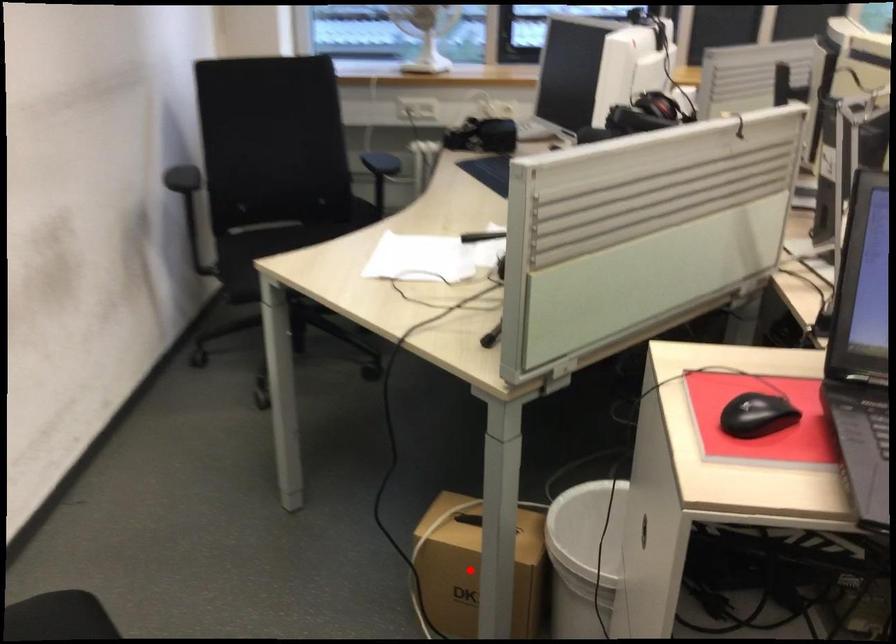
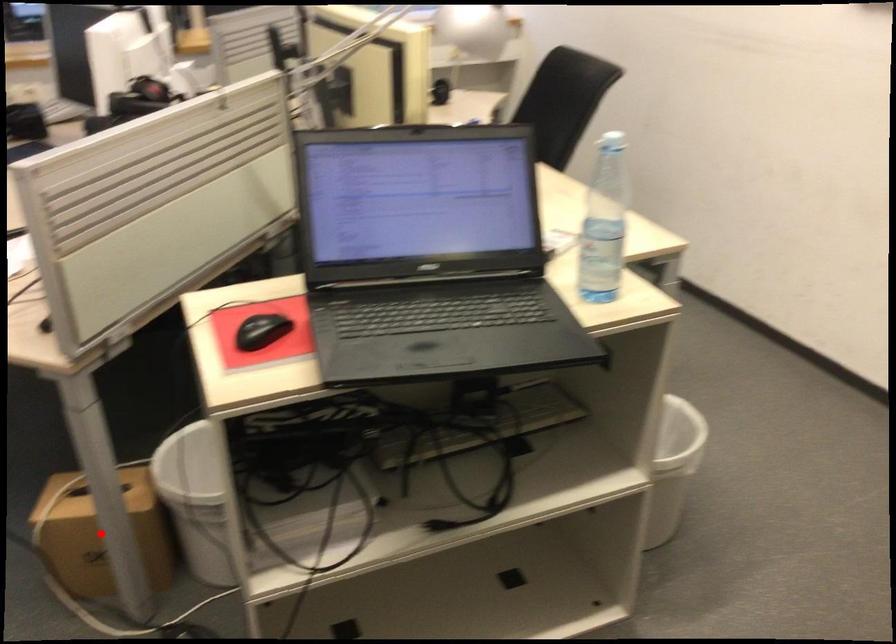
From the picture: I am providing you with two images of the same scene from different viewpoints. A red point is marked on the first image and another point is marked on the second image. Are the points marked in image1 and image2 representing the same 3D position?

Yes